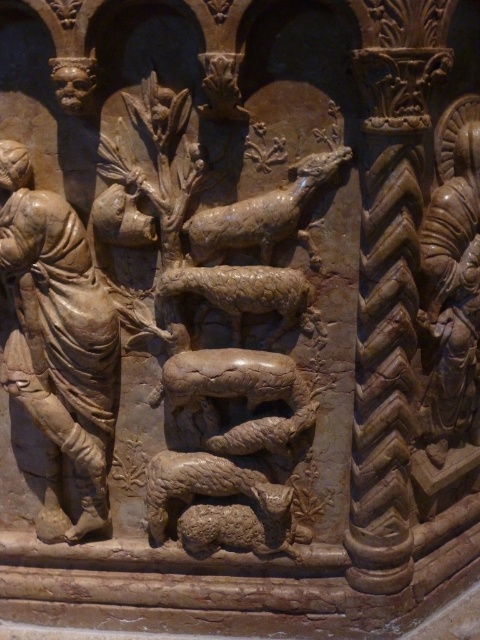
How distant is matte stone figure at right from brown stone dog at center?

matte stone figure at right and brown stone dog at center are 10.21 inches apart.

Can you confirm if matte stone figure at right is positioned below brown stone dog at center?

Indeed, matte stone figure at right is positioned under brown stone dog at center.

You are a GUI agent. You are given a task and a screenshot of the screen. Output one action in this format:
    pyautogui.click(x=<x>, y=<y>)
    Task: Click on the matte stone figure at right
    The image size is (480, 640).
    Given the screenshot: What is the action you would take?
    pyautogui.click(x=451, y=282)

Can you confirm if brown stone rabbit at center is smaller than brown stone rabbit at lower center?

No.

Can you confirm if brown stone rabbit at center is bigger than brown stone rabbit at lower center?

Indeed, brown stone rabbit at center has a larger size compared to brown stone rabbit at lower center.

The width and height of the screenshot is (480, 640). In order to click on brown stone rabbit at center in this screenshot , I will do `click(204, 484)`.

Which is more to the left, brown stone rabbit at lower center or brown textured snake at center?

From the viewer's perspective, brown stone rabbit at lower center appears more on the left side.

What do you see at coordinates (239, 529) in the screenshot? Image resolution: width=480 pixels, height=640 pixels. I see `brown stone rabbit at lower center` at bounding box center [239, 529].

Identify the location of brown stone rabbit at lower center. The width and height of the screenshot is (480, 640). (239, 529).